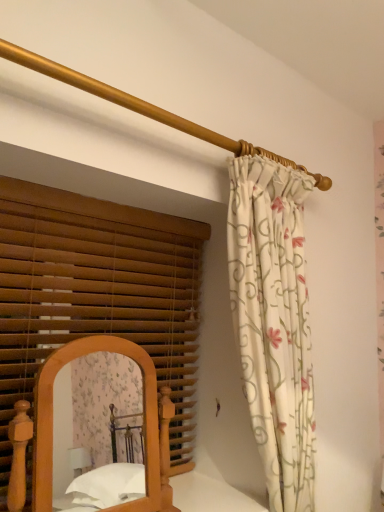
Describe the element at coordinates (97, 294) in the screenshot. I see `wooden blinds at left` at that location.

The height and width of the screenshot is (512, 384). What do you see at coordinates (109, 436) in the screenshot?
I see `wooden bed at lower left` at bounding box center [109, 436].

I want to click on wooden blinds at left, so click(x=97, y=294).

Does wooden blinds at left turn towards gold polished rod at upper center?

Yes, wooden blinds at left is aimed at gold polished rod at upper center.

In order to click on balustrade lying in front of the wooden blinds at left in this screenshot , I will do `click(145, 108)`.

Which object is further away from the camera taking this photo, wooden blinds at left or gold polished rod at upper center?

wooden blinds at left is behind.

Considering the relative sizes of wooden blinds at left and gold polished rod at upper center in the image provided, is wooden blinds at left taller than gold polished rod at upper center?

Indeed, wooden blinds at left has a greater height compared to gold polished rod at upper center.

I want to click on bed in front of the wooden blinds at left, so click(x=109, y=436).

Consider the image. Which point is more distant from viewer, (131,412) or (125,238)?

The point (131,412) is more distant.

Which object is wider, wooden bed at lower left or wooden blinds at left?

wooden bed at lower left is wider.

From the picture: From a real-world perspective, who is located lower, gold polished rod at upper center or floral fabric curtain at upper right?

From a 3D spatial view, floral fabric curtain at upper right is below.

Considering the sizes of objects gold polished rod at upper center and floral fabric curtain at upper right in the image provided, who is bigger, gold polished rod at upper center or floral fabric curtain at upper right?

floral fabric curtain at upper right.

Considering the relative positions of floral fabric curtain at upper right and wooden bed at lower left in the image provided, is floral fabric curtain at upper right to the right of wooden bed at lower left from the viewer's perspective?

Correct, you'll find floral fabric curtain at upper right to the right of wooden bed at lower left.

Is floral fabric curtain at upper right positioned with its back to wooden bed at lower left?

No.

Would you say floral fabric curtain at upper right is a long distance from wooden bed at lower left?

Indeed, floral fabric curtain at upper right is not near wooden bed at lower left.

Between floral fabric curtain at upper right and wooden bed at lower left, which one has smaller width?

With smaller width is wooden bed at lower left.

Considering the relative sizes of floral fabric curtain at upper right and gold polished rod at upper center in the image provided, is floral fabric curtain at upper right smaller than gold polished rod at upper center?

Actually, floral fabric curtain at upper right might be larger than gold polished rod at upper center.

Is floral fabric curtain at upper right inside or outside of gold polished rod at upper center?

floral fabric curtain at upper right is outside gold polished rod at upper center.

Could you tell me if floral fabric curtain at upper right is turned towards gold polished rod at upper center?

No, floral fabric curtain at upper right is not aimed at gold polished rod at upper center.

Consider the image. Which point is more forward, (305,487) or (8,42)?

Point (8,42)

Would you say wooden bed at lower left is to the left or to the right of floral fabric curtain at upper right in the picture?

Based on their positions, wooden bed at lower left is located to the left of floral fabric curtain at upper right.

Can you confirm if wooden bed at lower left is shorter than floral fabric curtain at upper right?

Indeed, wooden bed at lower left has a lesser height compared to floral fabric curtain at upper right.

Is wooden bed at lower left not close to floral fabric curtain at upper right?

Yes, wooden bed at lower left and floral fabric curtain at upper right are located far from each other.

Measure the distance from gold polished rod at upper center to wooden blinds at left.

gold polished rod at upper center and wooden blinds at left are 62.16 centimeters apart from each other.

Which object is further away from the camera, gold polished rod at upper center or wooden blinds at left?

Positioned behind is wooden blinds at left.

Does gold polished rod at upper center touch wooden blinds at left?

No, gold polished rod at upper center is not next to wooden blinds at left.

You are a GUI agent. You are given a task and a screenshot of the screen. Output one action in this format:
    pyautogui.click(x=<x>, y=<y>)
    Task: Click on the shutter behind the gold polished rod at upper center
    The height and width of the screenshot is (512, 384).
    Given the screenshot: What is the action you would take?
    (97, 294)

Where is `shutter that appears on the left of gold polished rod at upper center`? This screenshot has height=512, width=384. shutter that appears on the left of gold polished rod at upper center is located at coordinates (97, 294).

Find the location of a particular element. This screenshot has width=384, height=512. shutter lying behind the wooden bed at lower left is located at coordinates (97, 294).

Based on their spatial positions, is gold polished rod at upper center or wooden bed at lower left further from floral fabric curtain at upper right?

wooden bed at lower left lies further to floral fabric curtain at upper right than the other object.

Estimate the real-world distances between objects in this image. Which object is closer to wooden bed at lower left, wooden blinds at left or floral fabric curtain at upper right?

wooden blinds at left.

From the image, which object appears to be farther from gold polished rod at upper center, floral fabric curtain at upper right or wooden blinds at left?

Based on the image, wooden blinds at left appears to be further to gold polished rod at upper center.

When comparing their distances from gold polished rod at upper center, does wooden bed at lower left or wooden blinds at left seem closer?

wooden blinds at left.

From the image, which object appears to be farther from gold polished rod at upper center, floral fabric curtain at upper right or wooden bed at lower left?

wooden bed at lower left lies further to gold polished rod at upper center than the other object.

Looking at this image, when comparing their distances from floral fabric curtain at upper right, does wooden bed at lower left or wooden blinds at left seem closer?

wooden blinds at left is positioned closer to the anchor floral fabric curtain at upper right.

Looking at the image, which one is located further to floral fabric curtain at upper right, wooden blinds at left or wooden bed at lower left?

wooden bed at lower left is positioned further to the anchor floral fabric curtain at upper right.

Which object lies further to the anchor point wooden blinds at left, wooden bed at lower left or gold polished rod at upper center?

Among the two, wooden bed at lower left is located further to wooden blinds at left.

The image size is (384, 512). Identify the location of bed between wooden blinds at left and floral fabric curtain at upper right from left to right. pyautogui.click(x=109, y=436).

The image size is (384, 512). What are the coordinates of `shutter between gold polished rod at upper center and wooden bed at lower left vertically` in the screenshot? It's located at (97, 294).

Find the location of `curtain between gold polished rod at upper center and wooden bed at lower left from top to bottom`. curtain between gold polished rod at upper center and wooden bed at lower left from top to bottom is located at coordinates (273, 321).

Identify the location of curtain between gold polished rod at upper center and wooden blinds at left from top to bottom. (273, 321).